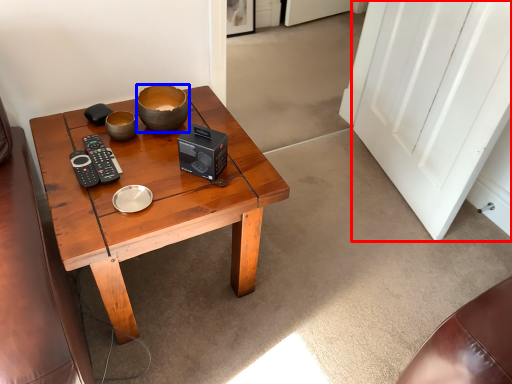
Question: Which of the following is the farthest to the observer, door (highlighted by a red box) or bowl (highlighted by a blue box)?

Choices:
 (A) door
 (B) bowl

Answer: (B)